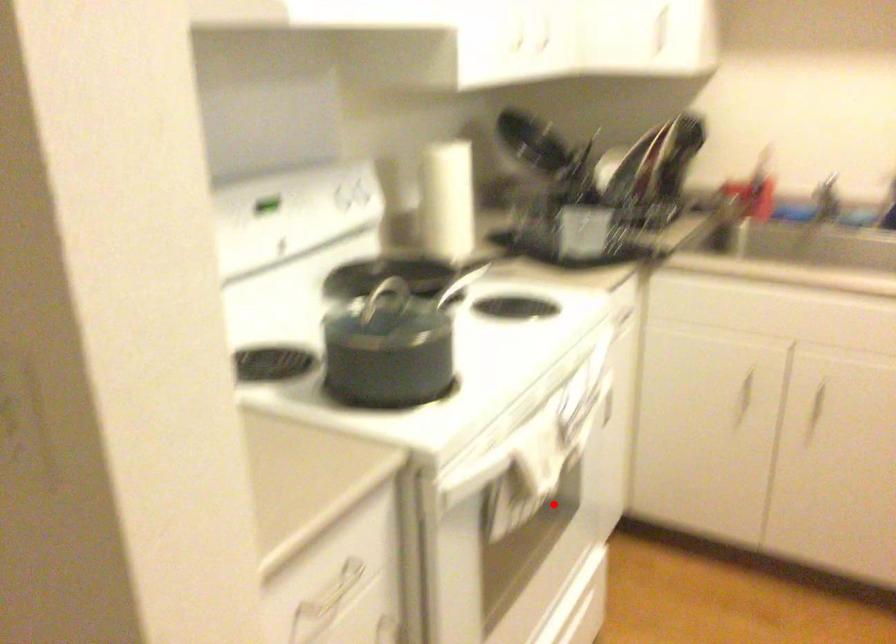
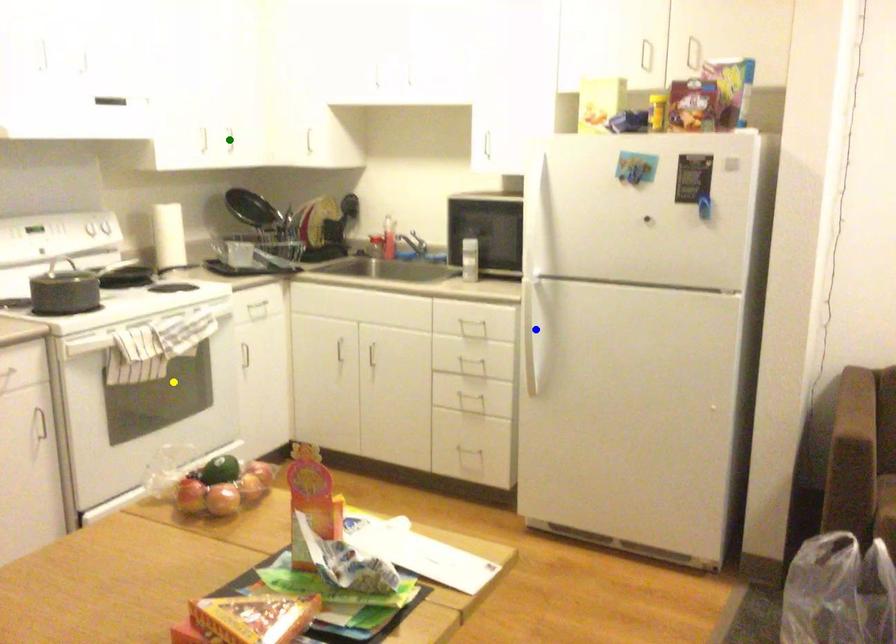
Question: I am providing you with two images of the same scene from different viewpoints. A red point is marked on the first image. You are given multiple points on the second image. In image 2, which mark is for the same physical point as the one in image 1?

Choices:
 (A) green point
 (B) yellow point
 (C) blue point

Answer: (B)